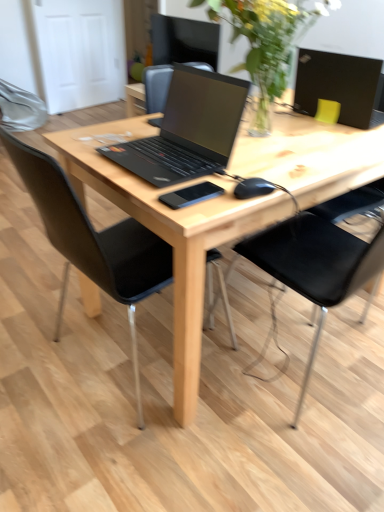
I want to click on free space in front of black matte phone at center, so click(x=198, y=210).